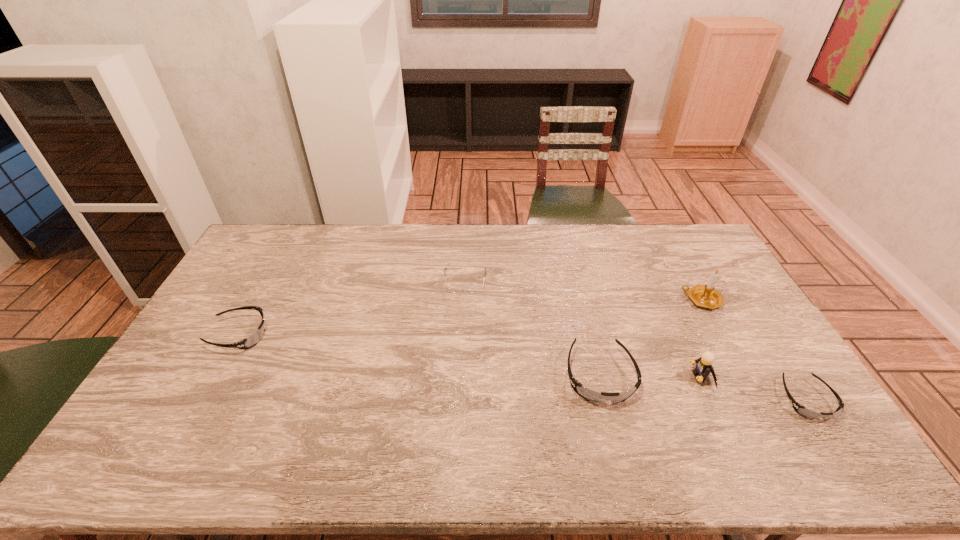
This screenshot has height=540, width=960. Find the location of `spectacles`. spectacles is located at coordinates (455, 287).

The height and width of the screenshot is (540, 960). I want to click on vacant area situated on the lenses of the second tallest sunglasses, so click(x=317, y=335).

Find the location of a particular element. vacant area situated on the lenses of the fourth shortest object is located at coordinates (612, 426).

The image size is (960, 540). I want to click on free location located 0.170m on the left of the second object from right to left, so click(x=632, y=300).

Where is `vacant space located 0.360m on the front-facing side of the fourth object from left to right`? This screenshot has width=960, height=540. vacant space located 0.360m on the front-facing side of the fourth object from left to right is located at coordinates (563, 376).

Locate an element on the screen. free spot located 0.190m on the front-facing side of the fourth object from left to right is located at coordinates pyautogui.click(x=623, y=376).

At what (x,y) coordinates should I click in order to perform the action: click on vacant space situated 0.320m on the front-facing side of the fourth object from left to right. Please return your answer as a coordinate pair (x, y). Looking at the image, I should click on (577, 376).

Find the location of a particular element. vacant region located through the lenses of the fifth object from right to left is located at coordinates (463, 333).

Identify the location of object that is at the left edge. The width and height of the screenshot is (960, 540). (252, 340).

Identify the location of sunglasses positioned at the right edge. The image size is (960, 540). (801, 410).